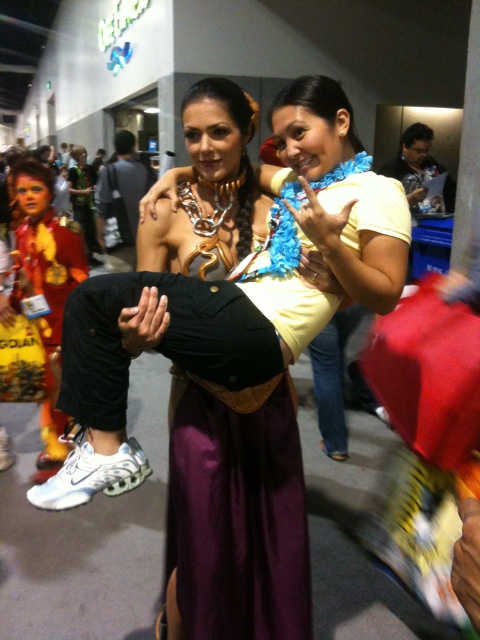
Question: Where is shiny metallic costume at left located in relation to dark gray fabric jacket at center in the image?

Choices:
 (A) above
 (B) below

Answer: (B)

Question: Among these points, which one is nearest to the camera?

Choices:
 (A) (453, 180)
 (B) (226, 316)
 (C) (34, 236)
 (D) (141, 168)

Answer: (B)

Question: Observing the image, what is the correct spatial positioning of matte black pants at center in reference to dark gray fabric jacket at center?

Choices:
 (A) right
 (B) left

Answer: (A)

Question: Is shiny metallic costume at left positioned in front of dark gray fabric jacket at center?

Choices:
 (A) no
 (B) yes

Answer: (B)

Question: Estimate the real-world distances between objects in this image. Which object is closer to the matte black shirt at upper right?

Choices:
 (A) shiny metallic costume at left
 (B) matte black pants at center

Answer: (A)

Question: Estimate the real-world distances between objects in this image. Which object is closer to the dark gray fabric jacket at center?

Choices:
 (A) shiny metallic costume at left
 (B) matte black shirt at upper right

Answer: (A)